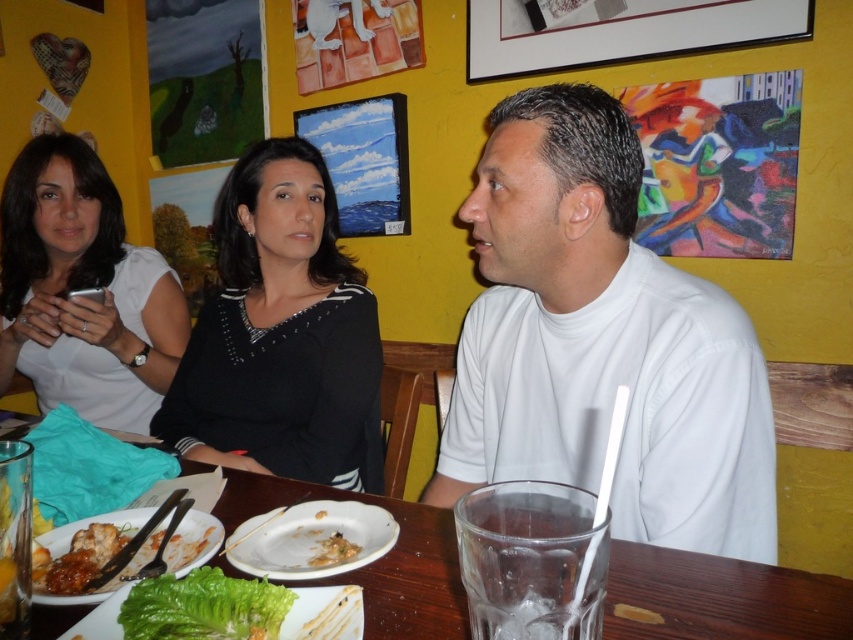
Question: Does clear glass at table right have a greater width compared to matte wooden picture frame at upper center?

Choices:
 (A) no
 (B) yes

Answer: (A)

Question: Is the position of white matte shirt at left more distant than that of transparent glass at center?

Choices:
 (A) yes
 (B) no

Answer: (A)

Question: Which point is closer to the camera taking this photo?

Choices:
 (A) (293, 394)
 (B) (578, 604)
 (C) (804, 627)

Answer: (B)

Question: Which of the following is the closest to the observer?

Choices:
 (A) green leafy lettuce at lower left
 (B) transparent glass at center
 (C) white matte shirt at left

Answer: (A)

Question: Is the position of white matte shirt at center more distant than that of white matte plate at lower center?

Choices:
 (A) yes
 (B) no

Answer: (A)

Question: Which is farther from the matte wooden picture frame at upper center?

Choices:
 (A) clear glass at table right
 (B) black jersey at center
 (C) white glossy plate at lower left
 (D) white matte shirt at left

Answer: (A)